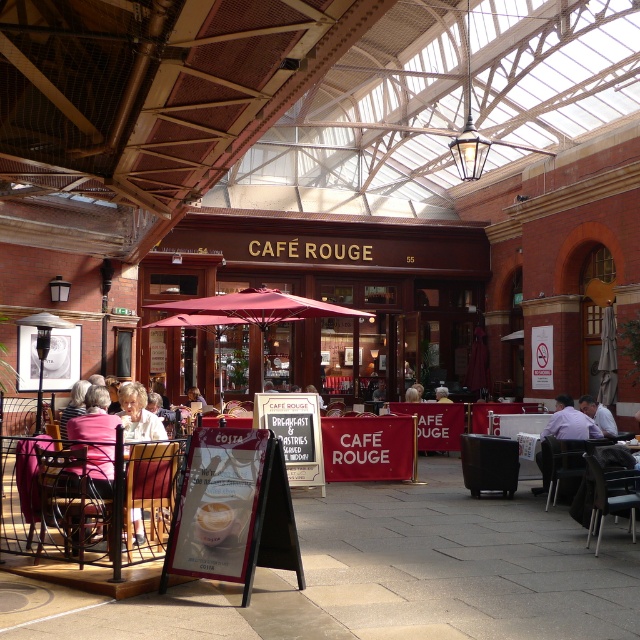
You are a customer entering the indoor cafe and need to sit down. You see a metallic wire chair at center and a yellow fabric shirt at center. Which object is taller and should you choose for seating?

The metallic wire chair at center is taller than the yellow fabric shirt at center, so you should choose the metallic wire chair at center for seating as it is designed for sitting.

You are standing at the entrance of the Cafe Rouge and want to reach the purple shirt at center without passing through the red fabric umbrella at center. Is this possible given their distance?

The red fabric umbrella at center is 5.57 meters away from the purple shirt at center, so you can reach the purple shirt at center without passing through the red fabric umbrella at center as they are separated by a considerable distance.